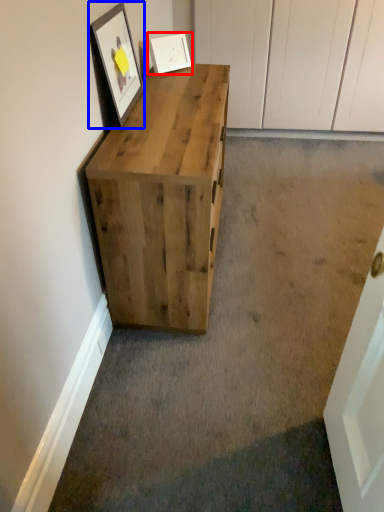
Question: Which point is closer to the camera, picture frame (highlighted by a red box) or picture frame (highlighted by a blue box)?

Choices:
 (A) picture frame
 (B) picture frame

Answer: (B)